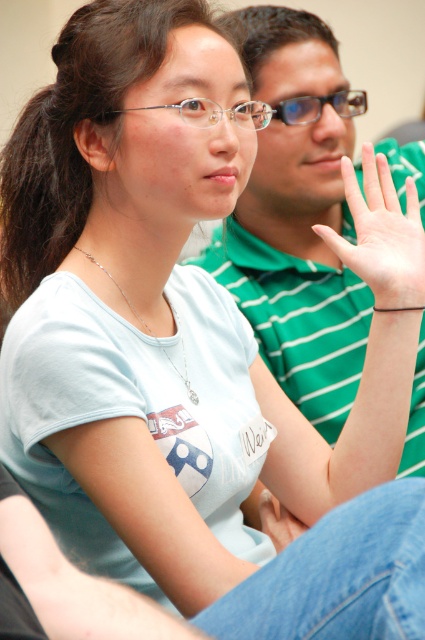
Question: Which of these objects is positioned farthest from the pale skin hand at center?

Choices:
 (A) clear plastic glasses at center
 (B) clear plastic glasses at upper center
 (C) green striped shirt at upper center

Answer: (B)

Question: Can you confirm if clear plastic glasses at center is wider than clear plastic glasses at upper center?

Choices:
 (A) yes
 (B) no

Answer: (A)

Question: Does green striped shirt at upper center come behind clear plastic glasses at center?

Choices:
 (A) no
 (B) yes

Answer: (B)

Question: Which object is the farthest from the green striped shirt at upper center?

Choices:
 (A) clear plastic glasses at center
 (B) clear plastic glasses at upper center
 (C) pale skin hand at center

Answer: (A)

Question: Which object appears farthest from the camera in this image?

Choices:
 (A) green striped shirt at upper center
 (B) pale skin hand at center

Answer: (A)

Question: Is green striped shirt at upper center to the right of clear plastic glasses at upper center from the viewer's perspective?

Choices:
 (A) yes
 (B) no

Answer: (A)